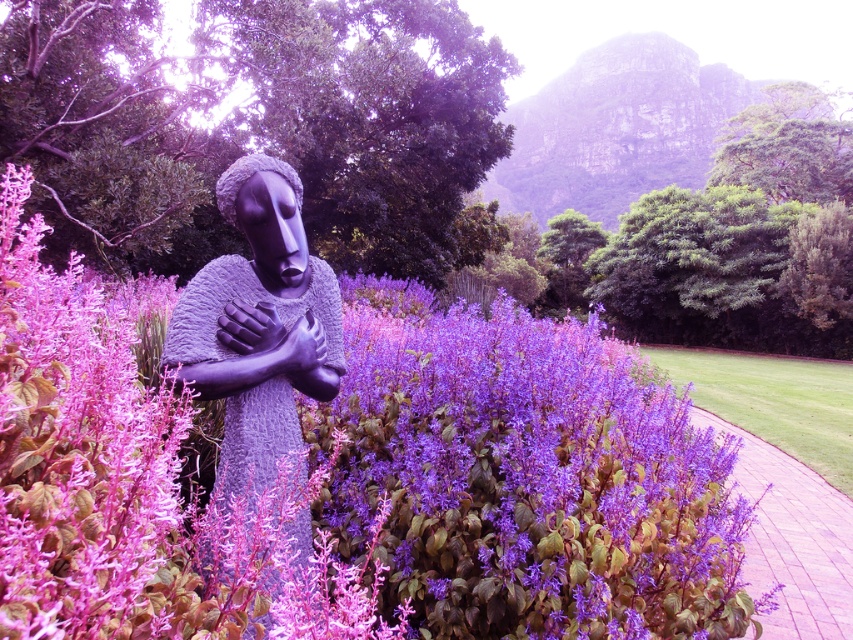
Based on the photo, you are standing at the point with coordinates point (x=314, y=358) and want to walk towards the statue. Is the point point (x=7, y=307) blocking your path?

Point (x=7, y=307) is in front of point (x=314, y=358), so yes, the point (x=7, y=307) is blocking your path.

You are an artist planning to paint this scene. You want to ensure that the matte black statue at center and the matte gray hand at center are proportionally accurate in your painting. Which object should you make larger in your artwork?

The matte black statue at center should be made larger in the artwork since it has a larger size compared to the matte gray hand at center according to the description.

You are standing in the serene outdoor setting described. You see a statue of a human figure and a purple matte flower at center. Which object is located at the coordinate point [352,476]?

The purple matte flower at center is located at the coordinate point [352,476].